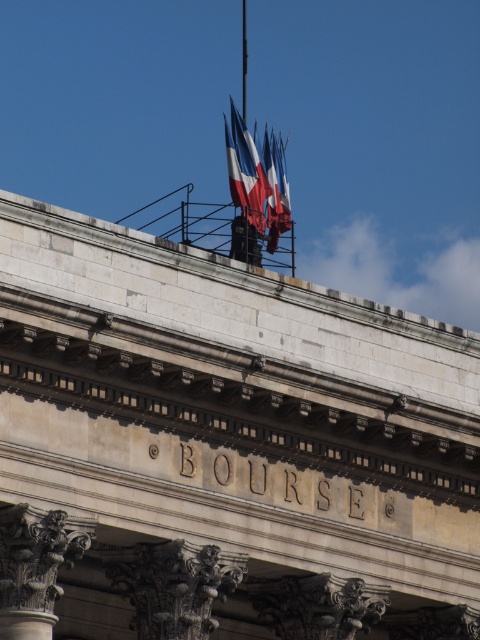
Question: Where is red-white-blue fabric flag at upper center located in relation to polished metallic flag at center in the image?

Choices:
 (A) below
 (B) above

Answer: (B)

Question: Does red-white-blue fabric flag at upper center have a smaller size compared to polished metallic flag at center?

Choices:
 (A) no
 (B) yes

Answer: (A)

Question: Which of the following is the closest to the observer?

Choices:
 (A) (280, 204)
 (B) (255, 216)

Answer: (B)

Question: Can you confirm if red-white-blue fabric flag at upper center is positioned to the right of polished metallic flag at center?

Choices:
 (A) yes
 (B) no

Answer: (B)

Question: Among these points, which one is farthest from the camera?

Choices:
 (A) (279, 134)
 (B) (272, 202)

Answer: (A)

Question: Which object is farther from the camera taking this photo?

Choices:
 (A) red-white-blue fabric flag at upper center
 (B) polished metallic flag at center

Answer: (B)